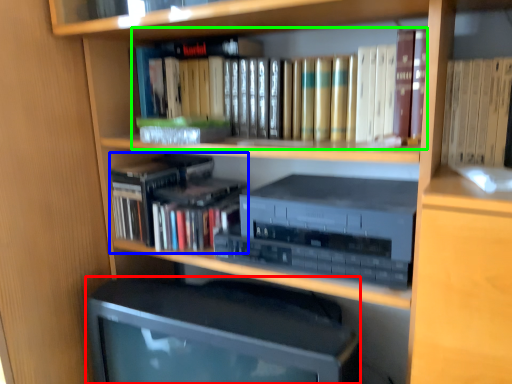
Question: Estimate the real-world distances between objects in this image. Which object is farther from computer monitor (highlighted by a red box), book (highlighted by a blue box) or book (highlighted by a green box)?

Choices:
 (A) book
 (B) book

Answer: (B)